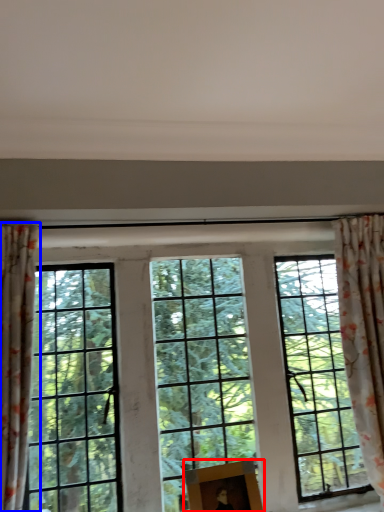
Question: Which object appears closest to the camera in this image, picture frame (highlighted by a red box) or curtain (highlighted by a blue box)?

Choices:
 (A) picture frame
 (B) curtain

Answer: (B)